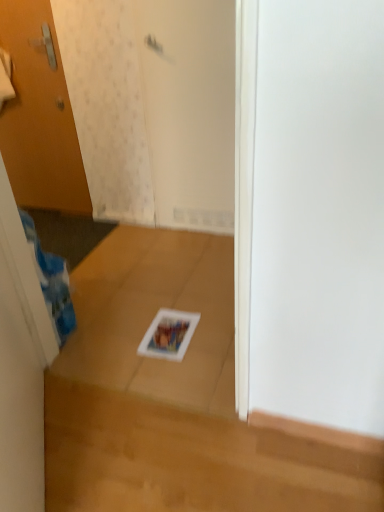
In order to click on free point in front of matte white magazine at center in this screenshot , I will do `click(175, 371)`.